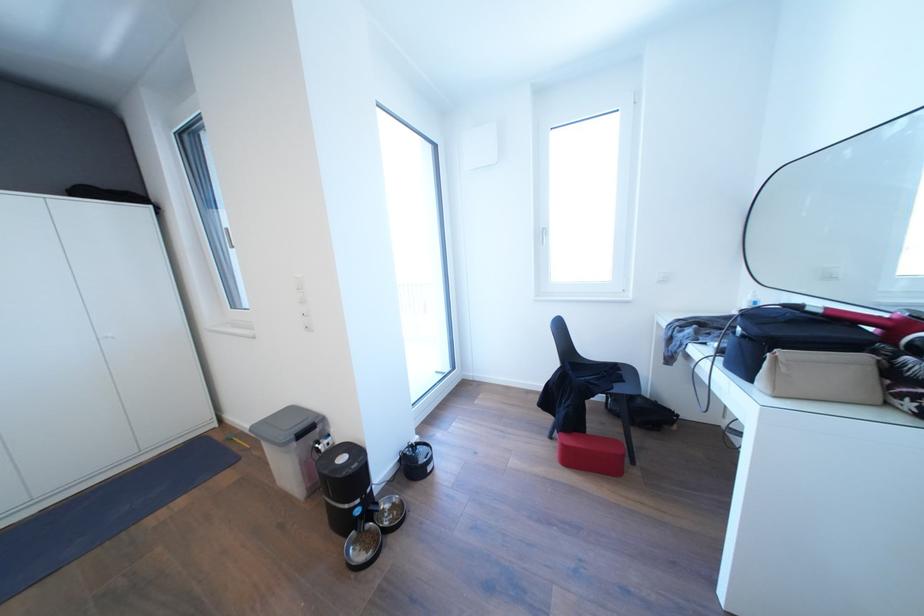
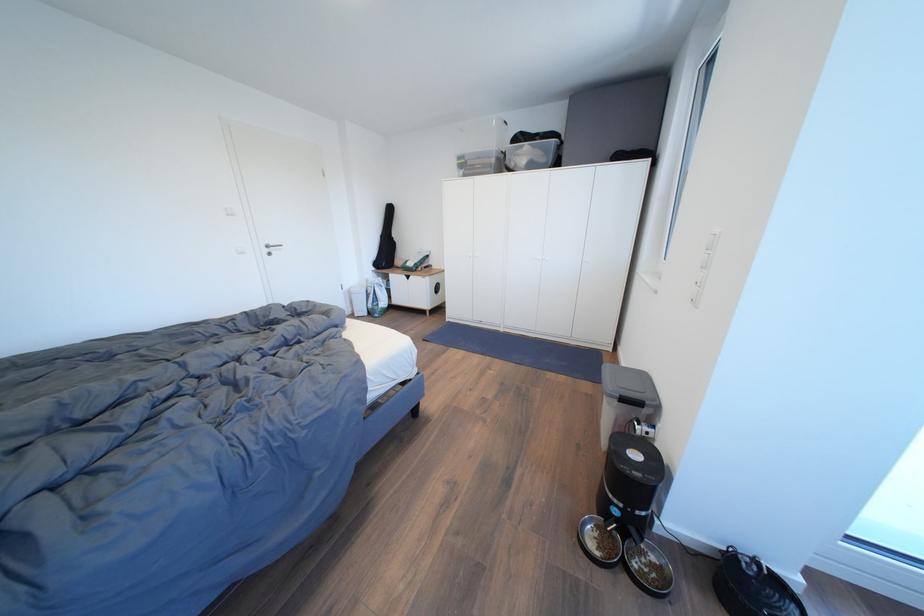
In the second image, find the point that corresponds to [349,464] in the first image.

(642, 460)